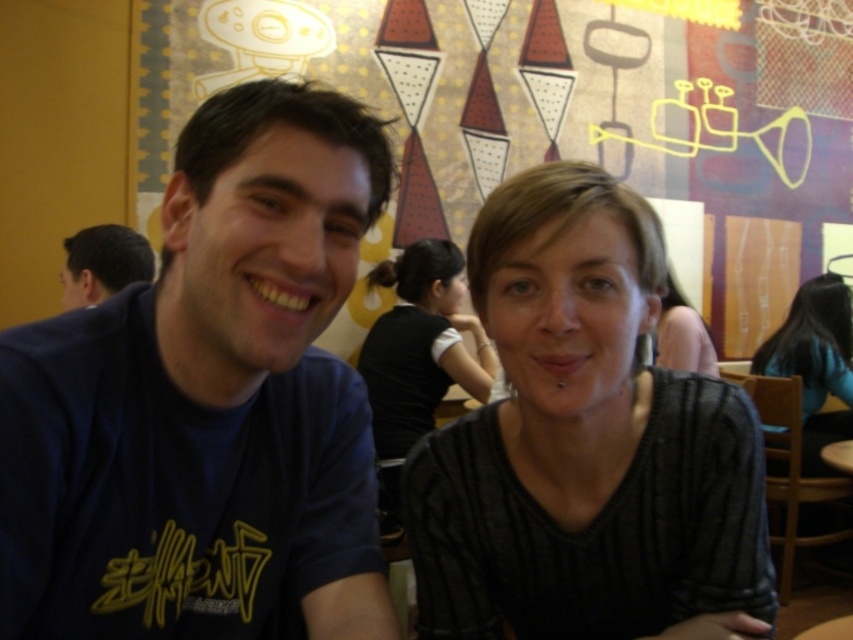
Who is lower down, matte black sweater at center or matte blue shirt at left?

Positioned lower is matte black sweater at center.

Does matte black sweater at center appear on the left side of matte blue shirt at left?

In fact, matte black sweater at center is to the right of matte blue shirt at left.

Which is in front, point (469, 320) or point (79, 298)?

Positioned in front is point (79, 298).

Identify the location of matte black sweater at center. 416,356.

Who is higher up, dark blue t-shirt at left or matte black shirt at center?

matte black shirt at center is above.

Which is below, dark blue t-shirt at left or matte black shirt at center?

Positioned lower is dark blue t-shirt at left.

The height and width of the screenshot is (640, 853). Describe the element at coordinates (207, 401) in the screenshot. I see `dark blue t-shirt at left` at that location.

At what (x,y) coordinates should I click in order to perform the action: click on dark blue t-shirt at left. Please return your answer as a coordinate pair (x, y). The height and width of the screenshot is (640, 853). Looking at the image, I should click on (207, 401).

Who is higher up, dark blue t-shirt at left or matte blue shirt at left?

matte blue shirt at left is higher up.

Between dark blue t-shirt at left and matte blue shirt at left, which one appears on the right side from the viewer's perspective?

From the viewer's perspective, dark blue t-shirt at left appears more on the right side.

The height and width of the screenshot is (640, 853). What are the coordinates of `dark blue t-shirt at left` in the screenshot? It's located at (207, 401).